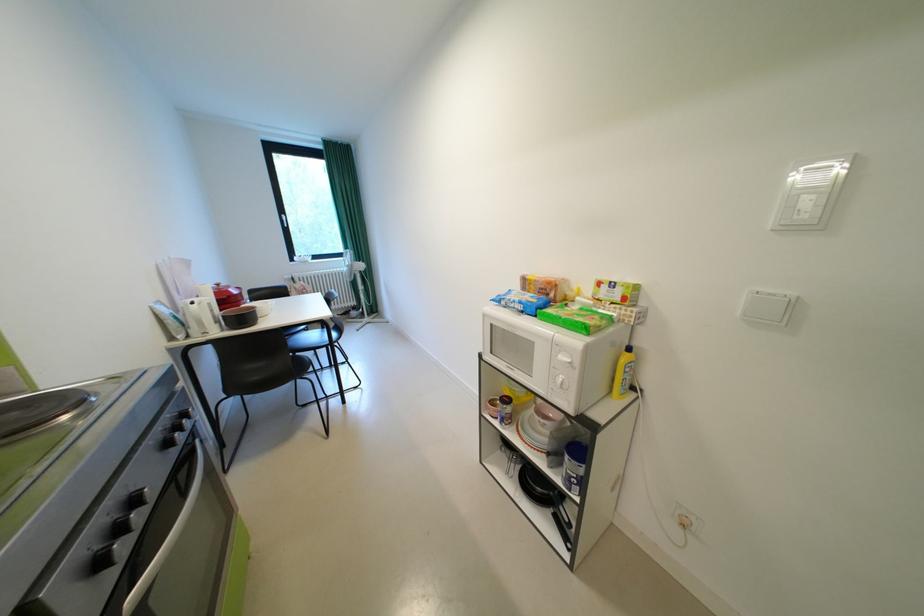
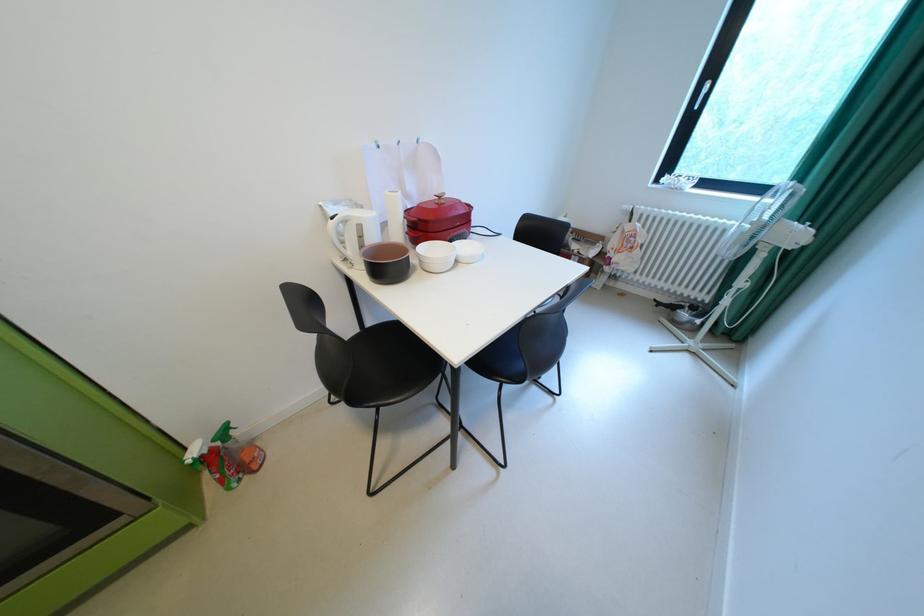
Where in the second image is the point corresponding to point (225, 317) from the first image?

(371, 246)